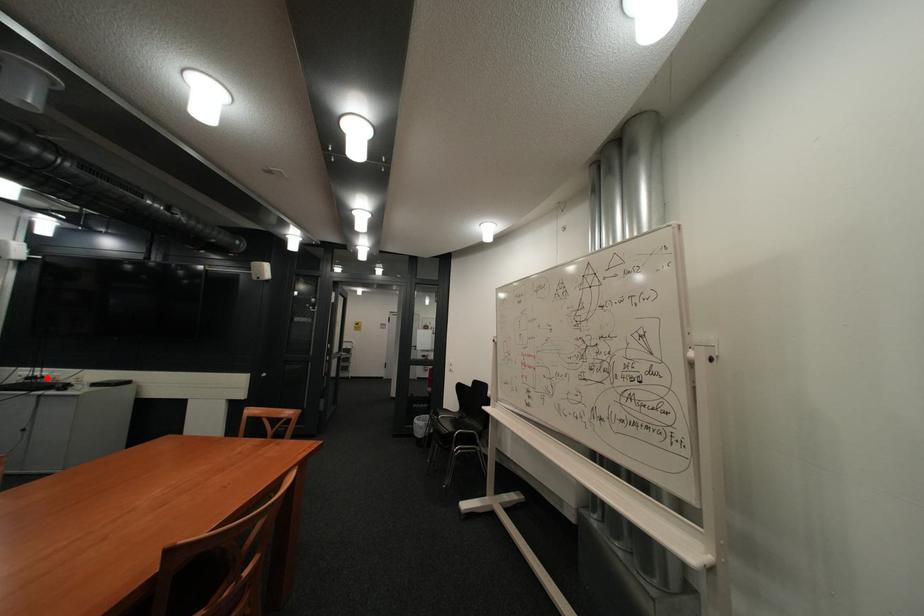
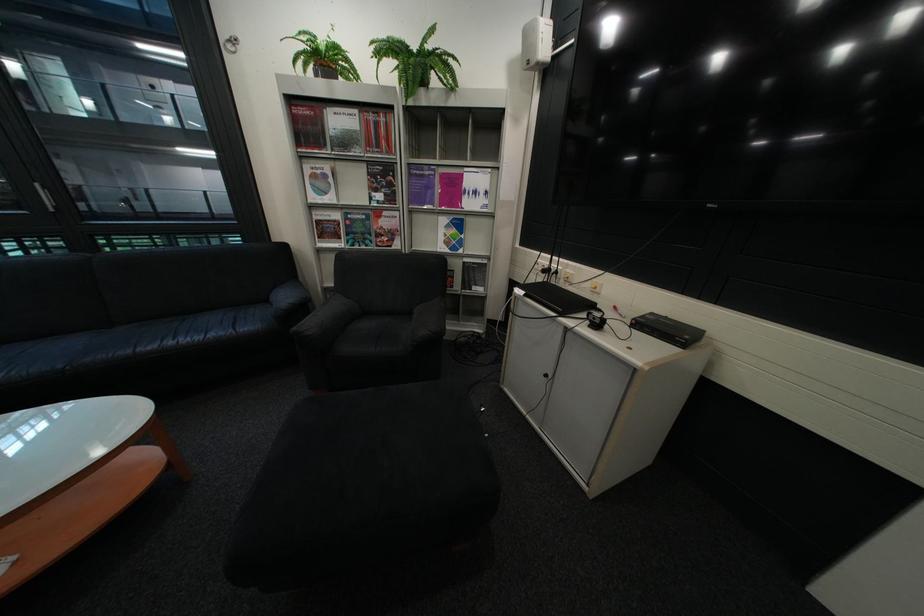
Question: I am providing you with two images of the same scene from different viewpoints. Image1 has a red point marked. In image2, the corresponding 3D location appears at what relative position? Reply with the corresponding letter.

Choices:
 (A) Closer
 (B) Farther

Answer: (B)